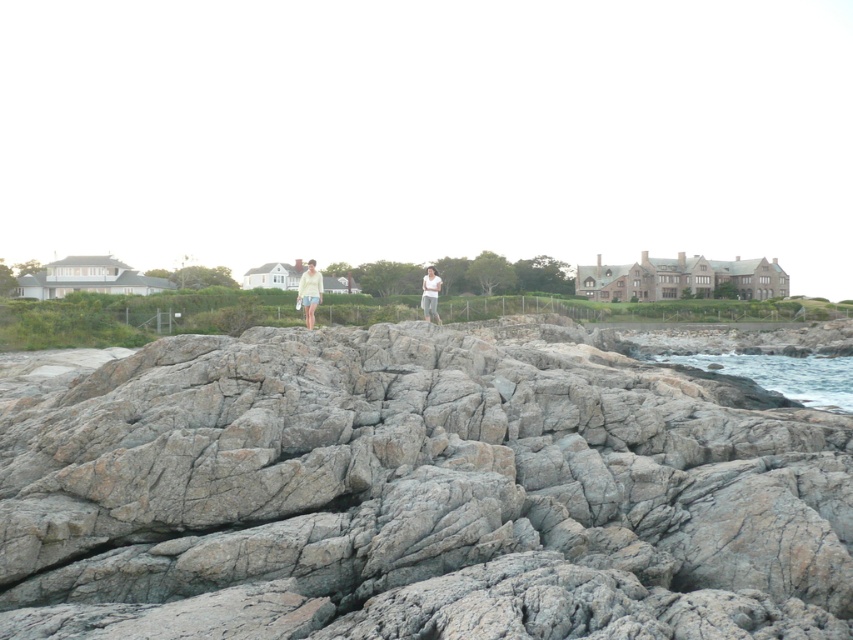
Which is above, blue water at lower right or light yellow fabric pants at center?

Positioned higher is light yellow fabric pants at center.

Does blue water at lower right have a lesser width compared to light yellow fabric pants at center?

In fact, blue water at lower right might be wider than light yellow fabric pants at center.

Which is in front, point (811, 358) or point (302, 300)?

Positioned in front is point (302, 300).

Where is `blue water at lower right`? blue water at lower right is located at coordinates coord(784,374).

Between light yellow fabric pants at center and white cotton shirt at center, which one appears on the right side from the viewer's perspective?

white cotton shirt at center is more to the right.

Which is in front, point (316, 292) or point (425, 280)?

Point (316, 292) is more forward.

Who is more distant from viewer, [310,273] or [424,307]?

Positioned behind is point [424,307].

Find the location of `light yellow fabric pants at center`. light yellow fabric pants at center is located at coordinates (309, 292).

Is point (445, 620) more distant than point (695, 362)?

No, (445, 620) is closer to viewer.

Can you confirm if gray rough rock at center is wider than blue water at lower right?

Yes.

Is point (772, 452) behind point (763, 358)?

That is False.

You are a GUI agent. You are given a task and a screenshot of the screen. Output one action in this format:
    pyautogui.click(x=<x>, y=<y>)
    Task: Click on the gray rough rock at center
    
    Given the screenshot: What is the action you would take?
    pyautogui.click(x=415, y=490)